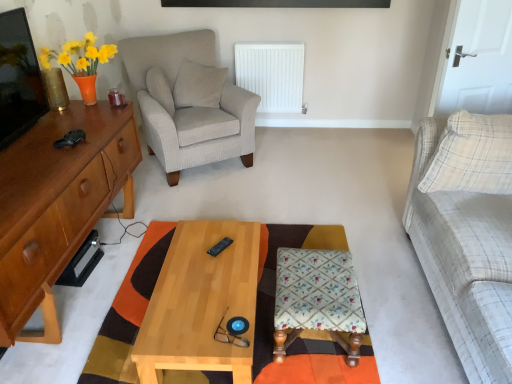
You are a GUI agent. You are given a task and a screenshot of the screen. Output one action in this format:
    pyautogui.click(x=<x>, y=<y>)
    Task: Click on the vacant space situated on the left part of light wood/texture coffee table at center
    
    Given the screenshot: What is the action you would take?
    pyautogui.click(x=101, y=312)